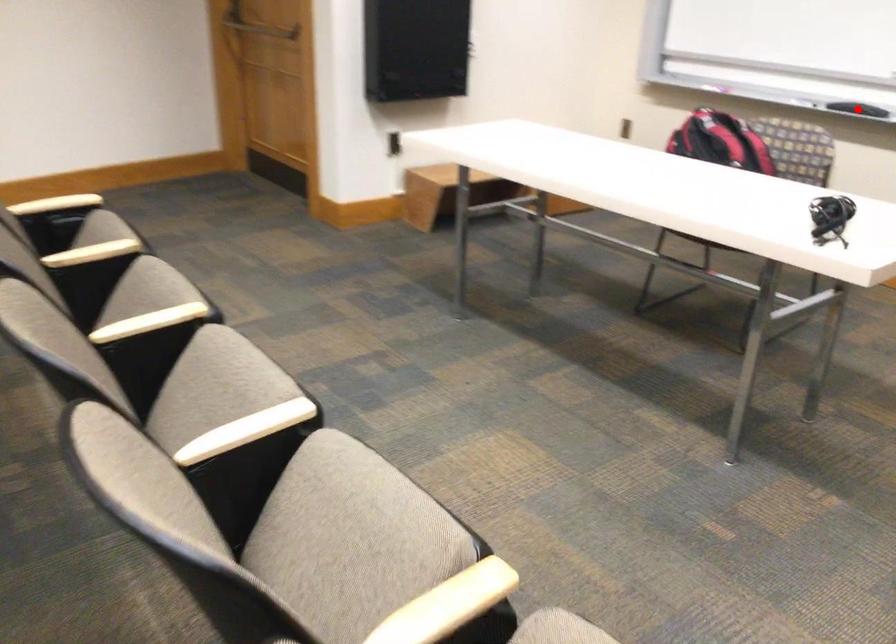
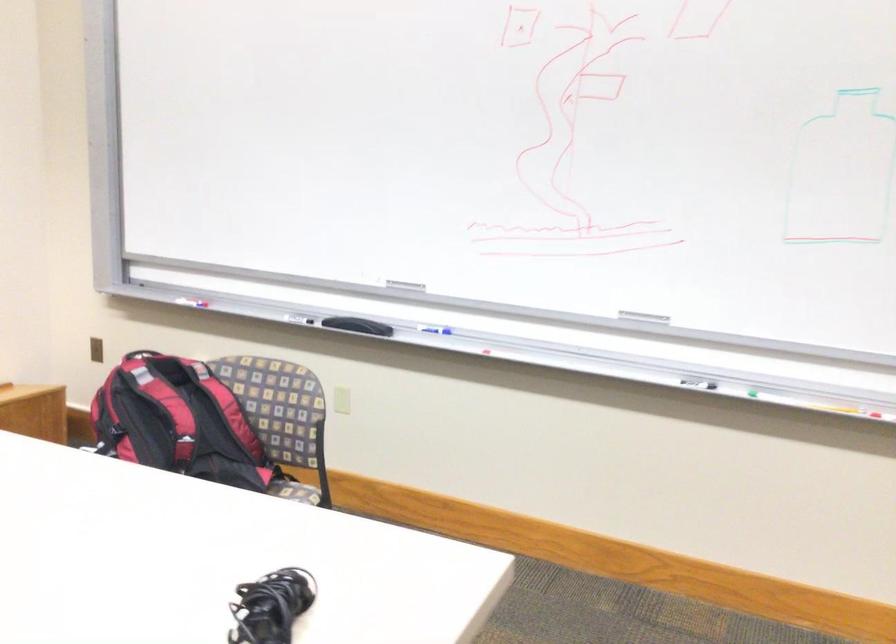
Question: I am providing you with two images of the same scene from different viewpoints. A red point is marked on the first image. At the location where the point appears in image 1, is it still visible in image 2?

Choices:
 (A) Yes
 (B) No

Answer: (B)